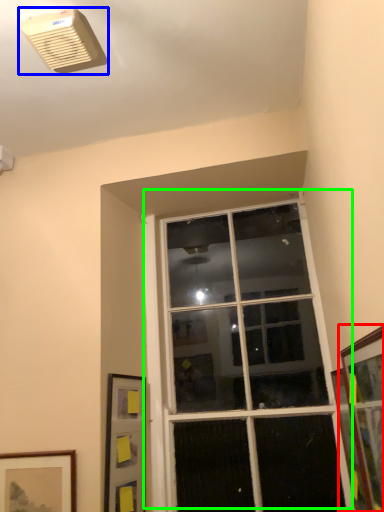
Question: Based on their relative distances, which object is nearer to picture frame (highlighted by a red box)? Choose from air conditioning (highlighted by a blue box) and window (highlighted by a green box).

Choices:
 (A) air conditioning
 (B) window

Answer: (B)